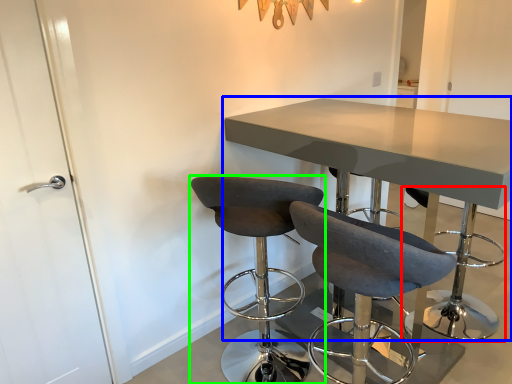
Question: Which object is positioned closest to bar stool (highlighted by a red box)? Select from table (highlighted by a blue box) and chair (highlighted by a green box).

Choices:
 (A) table
 (B) chair

Answer: (B)